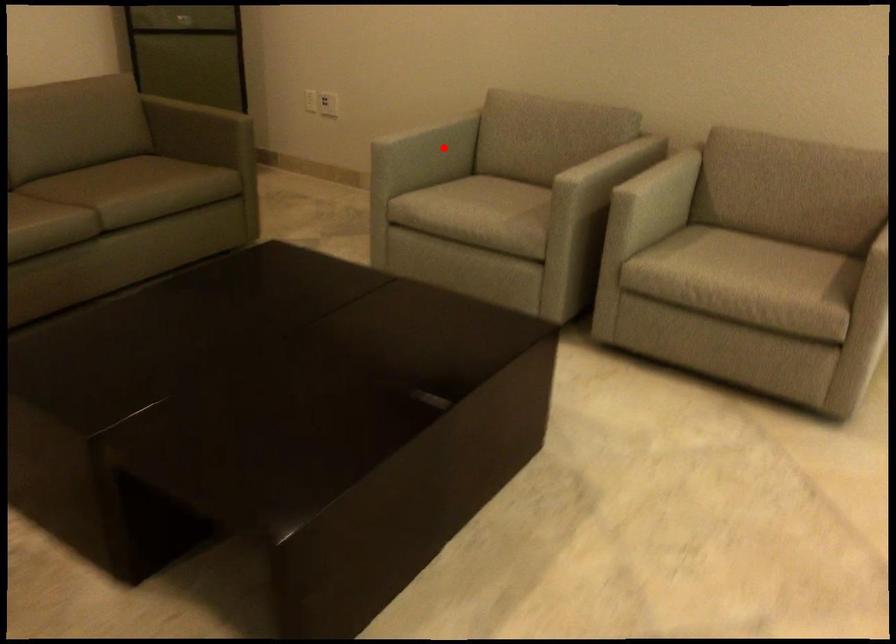
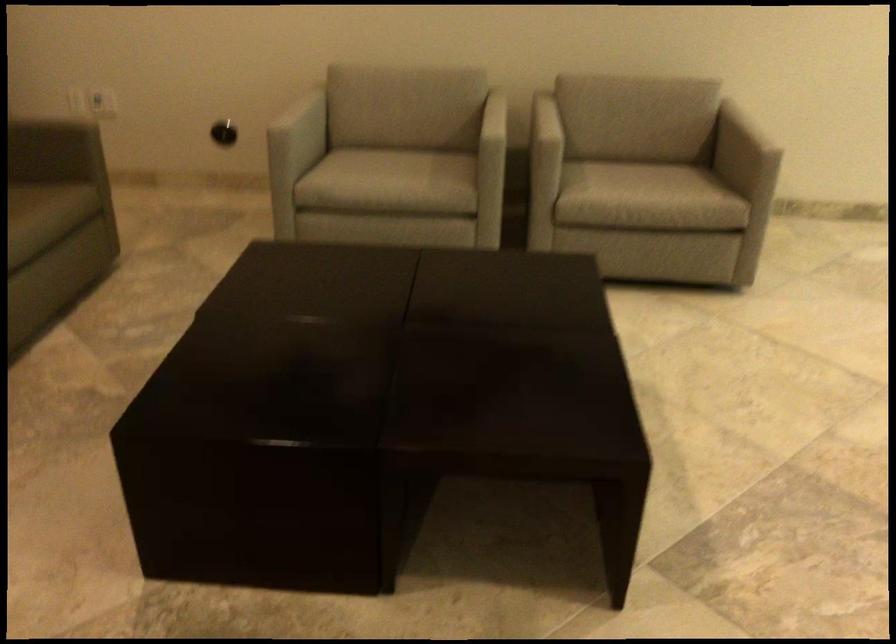
Where in the second image is the point corresponding to the highlighted location from the first image?

(304, 124)